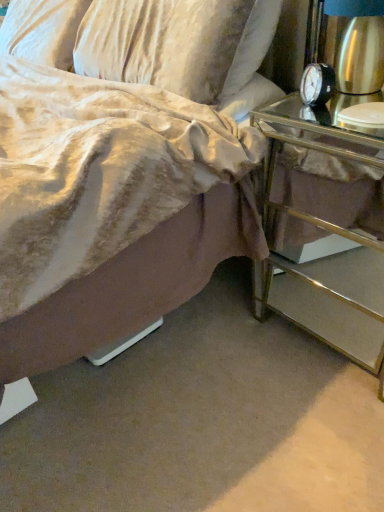
Question: Considering the relative sizes of black metal/aluminum alarm clock at upper right and metallic mirrored nightstand at right in the image provided, is black metal/aluminum alarm clock at upper right thinner than metallic mirrored nightstand at right?

Choices:
 (A) yes
 (B) no

Answer: (A)

Question: Is black metal/aluminum alarm clock at upper right behind metallic mirrored nightstand at right?

Choices:
 (A) no
 (B) yes

Answer: (B)

Question: Is black metal/aluminum alarm clock at upper right smaller than metallic mirrored nightstand at right?

Choices:
 (A) no
 (B) yes

Answer: (B)

Question: Can you confirm if black metal/aluminum alarm clock at upper right is positioned to the right of metallic mirrored nightstand at right?

Choices:
 (A) yes
 (B) no

Answer: (B)

Question: Could you tell me if black metal/aluminum alarm clock at upper right is facing metallic mirrored nightstand at right?

Choices:
 (A) yes
 (B) no

Answer: (B)

Question: From the image's perspective, is black metal/aluminum alarm clock at upper right on metallic mirrored nightstand at right?

Choices:
 (A) no
 (B) yes

Answer: (B)

Question: Is metallic mirrored nightstand at right with black metal/aluminum alarm clock at upper right?

Choices:
 (A) yes
 (B) no

Answer: (B)

Question: Would you say metallic mirrored nightstand at right is outside black metal/aluminum alarm clock at upper right?

Choices:
 (A) yes
 (B) no

Answer: (A)

Question: Is metallic mirrored nightstand at right closer to the viewer compared to black metal/aluminum alarm clock at upper right?

Choices:
 (A) no
 (B) yes

Answer: (B)

Question: Is metallic mirrored nightstand at right positioned behind black metal/aluminum alarm clock at upper right?

Choices:
 (A) no
 (B) yes

Answer: (A)

Question: Does metallic mirrored nightstand at right have a greater height compared to black metal/aluminum alarm clock at upper right?

Choices:
 (A) yes
 (B) no

Answer: (A)

Question: From the image's perspective, is metallic mirrored nightstand at right above black metal/aluminum alarm clock at upper right?

Choices:
 (A) no
 (B) yes

Answer: (A)

Question: From a real-world perspective, is metallic mirrored nightstand at right above or below black metal/aluminum alarm clock at upper right?

Choices:
 (A) above
 (B) below

Answer: (B)